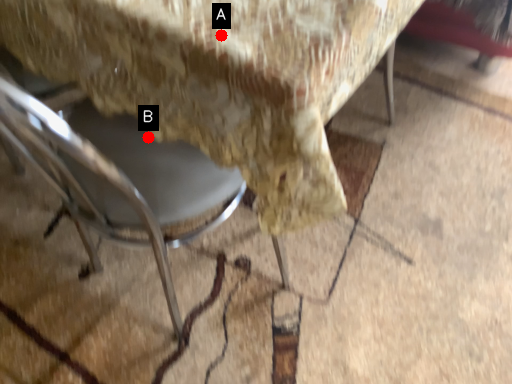
Question: Two points are circled on the image, labeled by A and B beside each circle. Which of the following is the closest to the observer?

Choices:
 (A) A is closer
 (B) B is closer

Answer: (A)